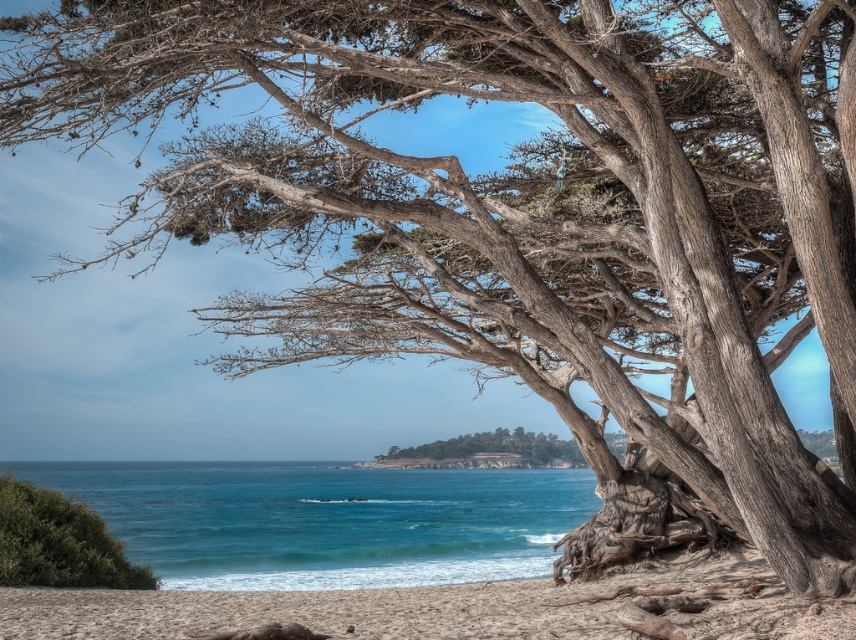
Question: Can you confirm if blue water at lower center is positioned to the left of sandy beach at lower center?

Choices:
 (A) no
 (B) yes

Answer: (B)

Question: Which object is farther from the camera taking this photo?

Choices:
 (A) sandy beach at lower center
 (B) green textured island at center

Answer: (B)

Question: Where is sandy beach at lower center located in relation to green textured island at center in the image?

Choices:
 (A) above
 (B) below

Answer: (A)

Question: Which point is closer to the camera?

Choices:
 (A) sandy beach at lower center
 (B) green textured island at center
 (C) blue water at lower center

Answer: (A)

Question: Which point is farther to the camera?

Choices:
 (A) blue water at lower center
 (B) green textured island at center
 (C) green leafy bush at lower left

Answer: (B)

Question: Is sandy beach at lower center thinner than green leafy bush at lower left?

Choices:
 (A) no
 (B) yes

Answer: (A)